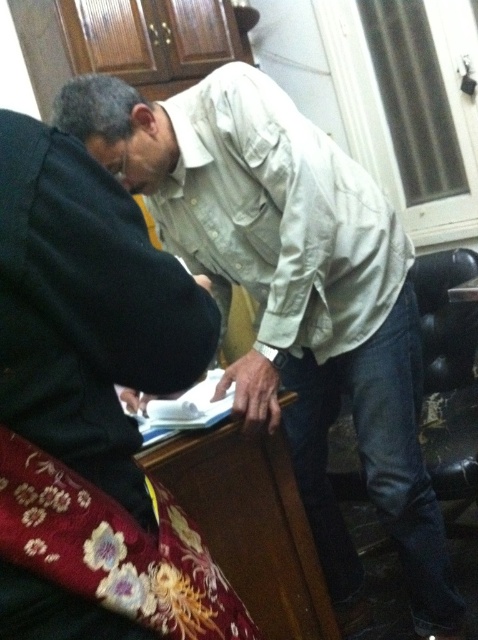
You are organizing a meeting and need to place a notebook between the black matte laptop at left and the light beige cotton shirt at center. Can the notebook fit between them if the notebook is 12 inches wide?

The black matte laptop at left is narrower than the light beige cotton shirt at center. However, the exact distance between them isn not specified. Without knowing the space between the two objects, it is impossible to determine if the notebook will fit.

You are a delivery person who needs to place a small package on the desk. The desk has the black matte laptop at left and the light beige cotton shirt at center. Where should you place the package so it doesn t block either object?

Place the package to the right of the light beige cotton shirt at center since the black matte laptop at left is in front of it, so placing it to the right would keep it unobstructed.